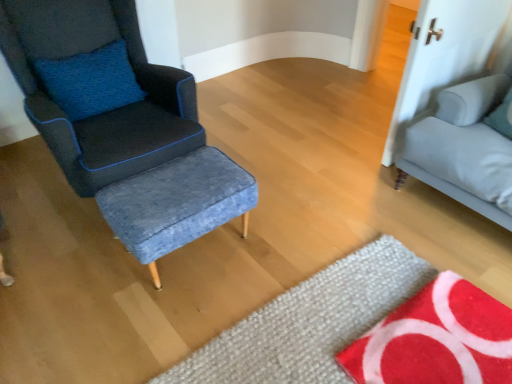
At what (x,y) coordinates should I click in order to perform the action: click on free space that is in between light gray fabric studio couch at right and textured wool mat at lower center, positioned as the 2th mat in right-to-left order. Please return your answer as a coordinate pair (x, y). The height and width of the screenshot is (384, 512). Looking at the image, I should click on (376, 250).